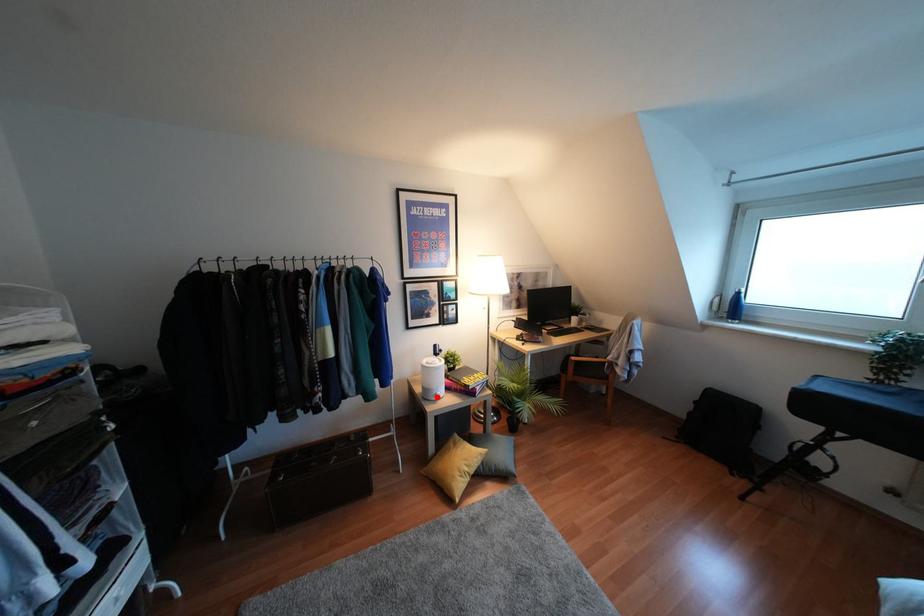
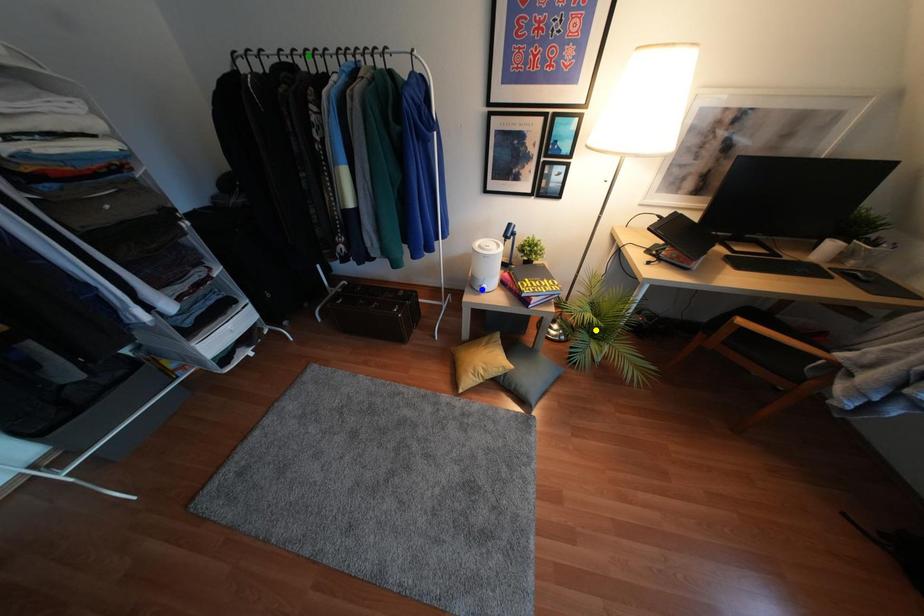
Question: I am providing you with two images of the same scene from different viewpoints. A red point is marked on the first image. You are given multiple points on the second image. Which point in image 2 represents the same 3d spot as the red point in image 1?

Choices:
 (A) yellow point
 (B) blue point
 (C) green point

Answer: (B)